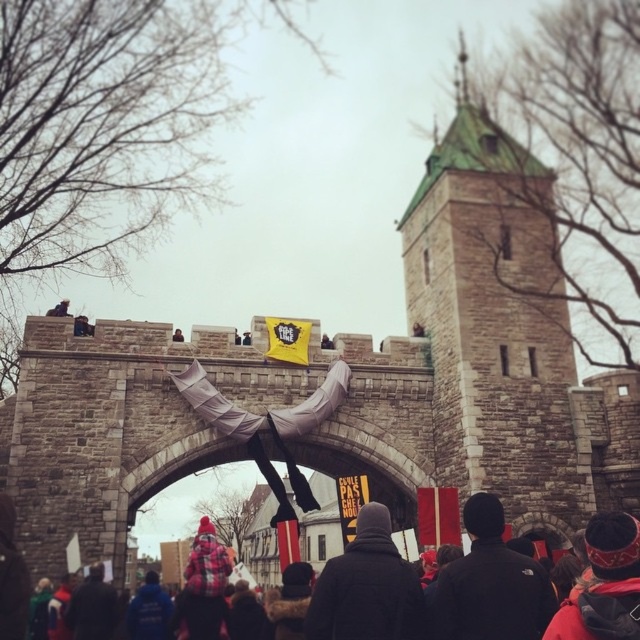
Question: Which point is farther from the camera taking this photo?

Choices:
 (A) (72, 611)
 (B) (356, 547)
 (C) (307, 632)
 (D) (472, 621)

Answer: (A)

Question: Which of the following is the farthest from the observer?

Choices:
 (A) (620, 550)
 (B) (476, 618)

Answer: (B)

Question: Where is black matte jacket at center located in relation to black woolen hat at center in the image?

Choices:
 (A) above
 (B) below

Answer: (A)

Question: Is black matte jacket at center wider than dark blue jacket at lower left?

Choices:
 (A) no
 (B) yes

Answer: (B)

Question: From the image, what is the correct spatial relationship of red knit hat at center in relation to black woolen hat at center?

Choices:
 (A) right
 (B) left

Answer: (B)

Question: Which of the following is the farthest from the observer?

Choices:
 (A) (369, 588)
 (B) (104, 611)
 (C) (476, 560)

Answer: (B)